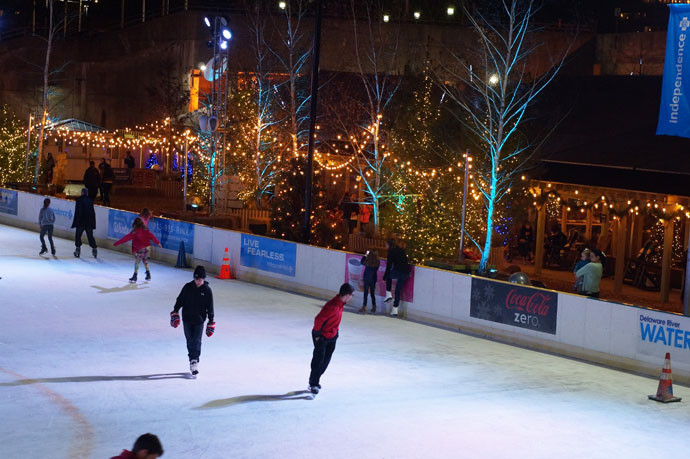
Identify the location of christmas tree. (290, 203).